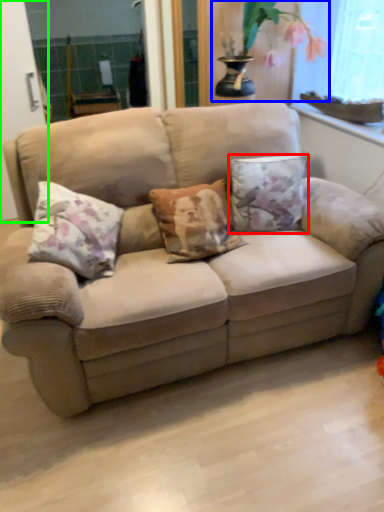
Question: Considering the real-world distances, which object is farthest from pillow (highlighted by a red box)? floral arrangement (highlighted by a blue box) or screen door (highlighted by a green box)?

Choices:
 (A) floral arrangement
 (B) screen door

Answer: (B)